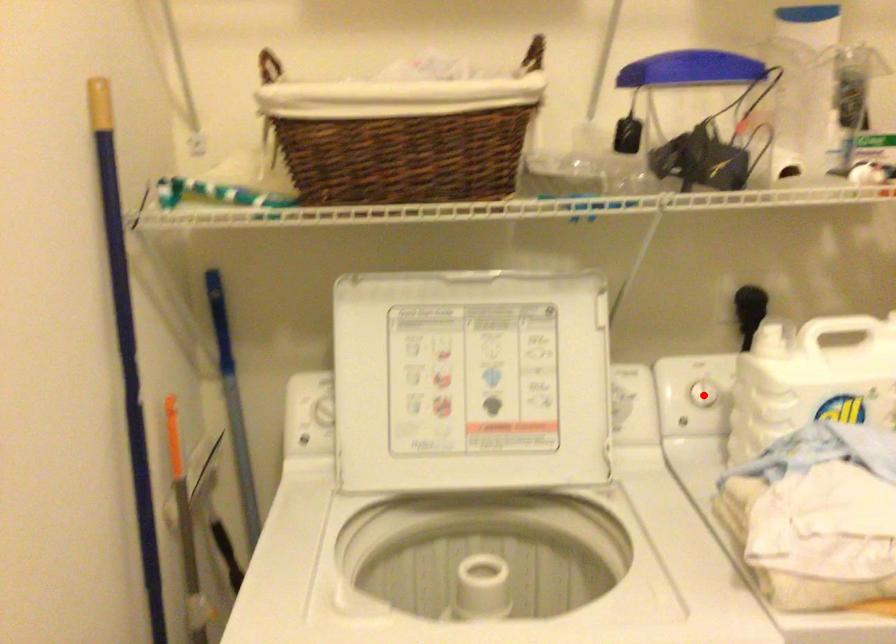
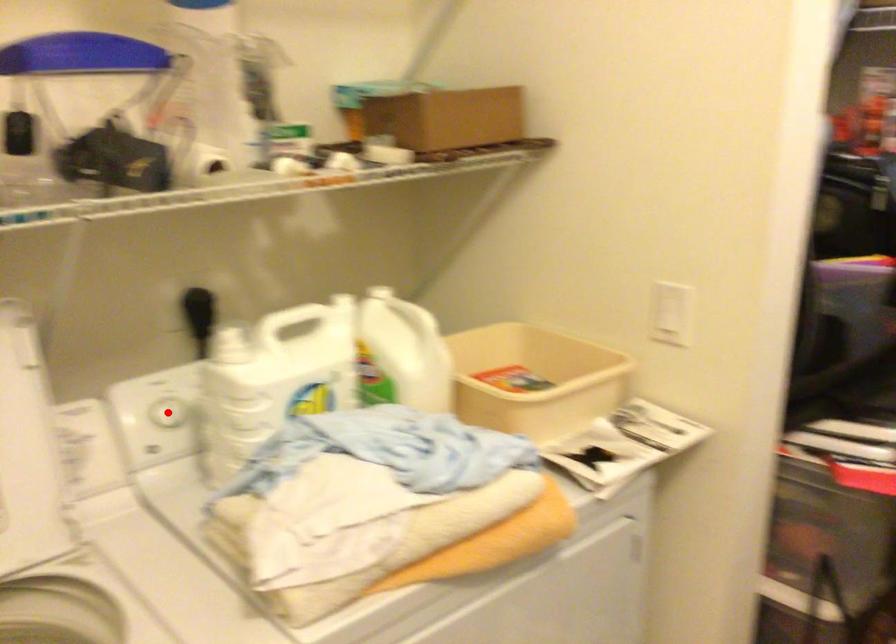
I am providing you with two images of the same scene from different viewpoints. A red point is marked on the first image and another point is marked on the second image. Do the highlighted points in image1 and image2 indicate the same real-world spot?

Yes